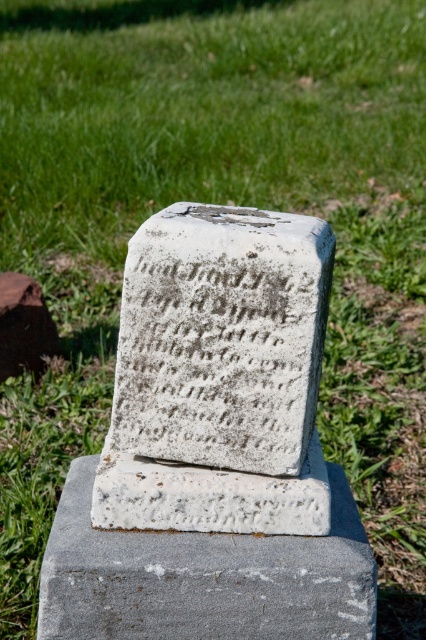
Looking at this image, you are a groundskeeper trying to place a new wooden plaque next to the white stone gravestone at center and the brown wood at center. Which object should you place the plaque next to if you want it to be near the smaller one?

The brown wood at center is smaller than the white stone gravestone at center, so you should place the plaque next to the brown wood at center.

You are standing in a cemetery and see the white stone gravestone at center and the gray concrete at center. Which object is closer to you?

The white stone gravestone at center is closer to you because it is in front of the gray concrete at center.